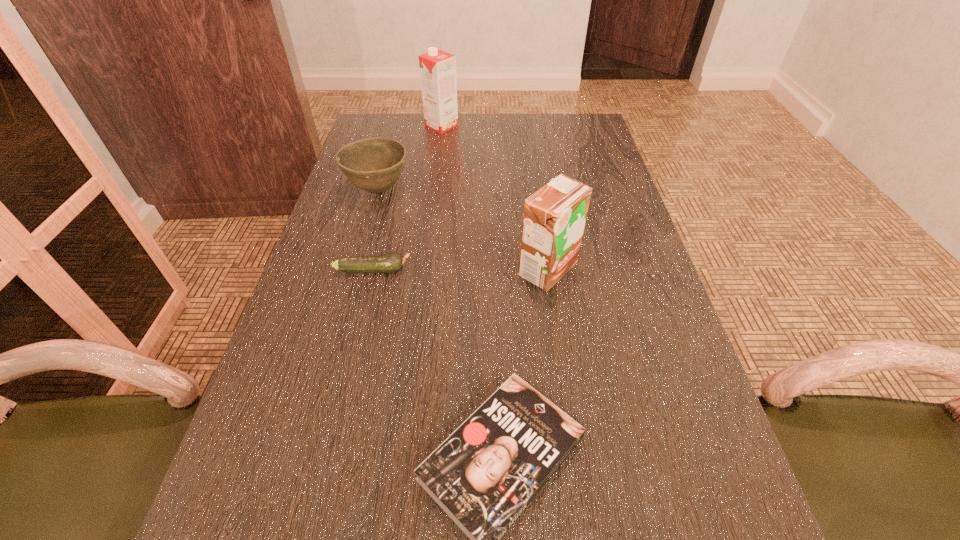
This screenshot has width=960, height=540. I want to click on free spot located on the front of the second farthest object, so click(357, 267).

I want to click on vacant region located 0.050m at the blossom end of the zucchini, so click(433, 270).

Where is `object that is at the far edge`? The width and height of the screenshot is (960, 540). object that is at the far edge is located at coordinates (437, 68).

Find the location of `bowl located in the left edge section of the desktop`. bowl located in the left edge section of the desktop is located at coordinates (373, 164).

The width and height of the screenshot is (960, 540). I want to click on zucchini that is at the left edge, so click(x=392, y=262).

Where is `object that is at the right edge`? object that is at the right edge is located at coordinates tap(554, 217).

Locate an element on the screen. free point at the far edge is located at coordinates (426, 148).

The image size is (960, 540). I want to click on vacant area at the left edge, so click(322, 266).

In the image, there is a desktop. What are the coordinates of `vacant area at the right edge` in the screenshot? It's located at (592, 291).

In order to click on vacant space at the far left corner in this screenshot , I will do `click(370, 131)`.